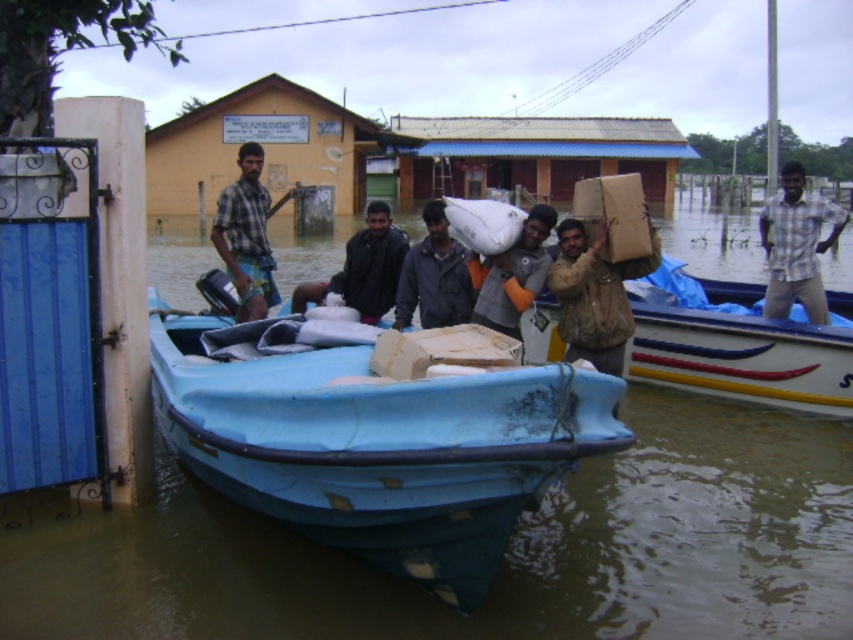
You are a delivery person needing to place a package between the dark gray fabric jacket at center and the matte gray jacket at center. The package requires 1.5 meters of space. Is there enough space between them?

The dark gray fabric jacket at center is 1.83 meters from the matte gray jacket at center, so yes, there is enough space between them to place the package since the distance is greater than the required 1.5 meters.

You are standing at the point with coordinates (503, 561) in the flooded area. What object are you currently positioned on?

The point at coordinates (503, 561) corresponds to the blue plastic boat at center, so you are positioned on the blue plastic boat at center.